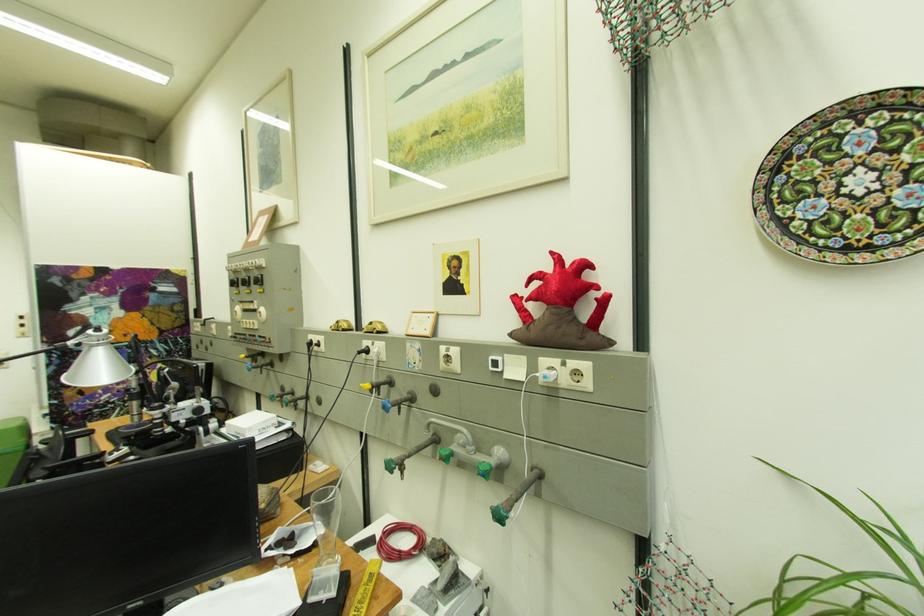
What do you see at coordinates (367, 386) in the screenshot?
I see `the yellow valve handle` at bounding box center [367, 386].